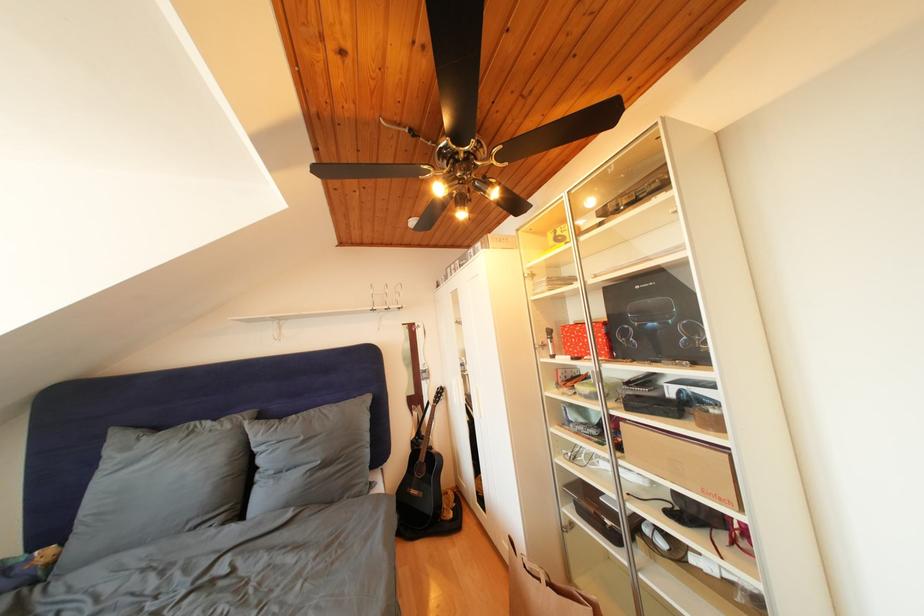
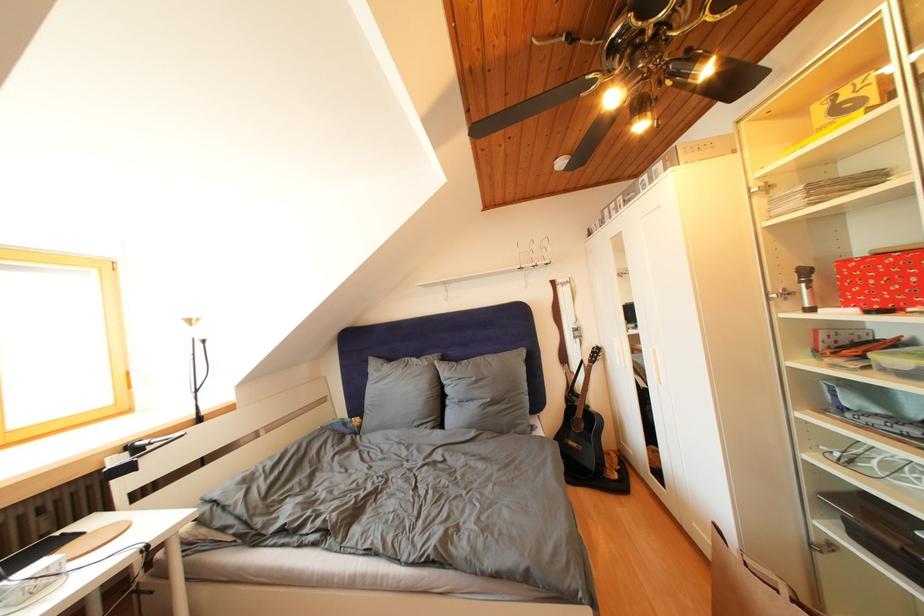
Question: Based on the continuous images, in which direction is the camera rotating? Reply with the corresponding letter.

Choices:
 (A) Left
 (B) Right
 (C) Up
 (D) Down

Answer: (A)